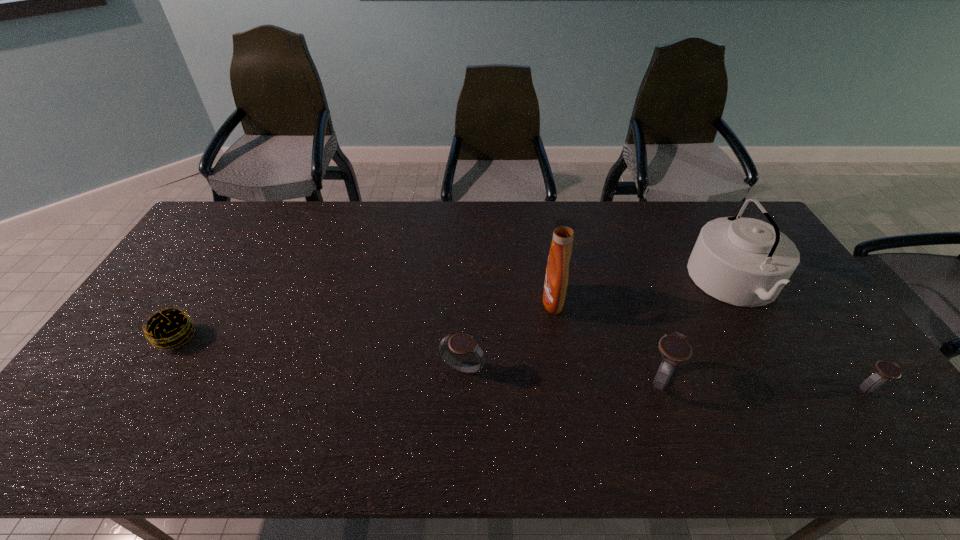
Find the location of a particular element. The height and width of the screenshot is (540, 960). kettle located in the right edge section of the desktop is located at coordinates (746, 262).

Find the location of a particular element. object at the near right corner is located at coordinates (884, 370).

This screenshot has height=540, width=960. In order to click on vacant region at the far edge of the desktop in this screenshot , I will do `click(690, 206)`.

Where is `vacant point at the near edge`? The height and width of the screenshot is (540, 960). vacant point at the near edge is located at coordinates (743, 408).

This screenshot has width=960, height=540. In the image, there is a desktop. In order to click on vacant space at the left edge in this screenshot , I will do `click(192, 307)`.

In the image, there is a desktop. Identify the location of blank space at the right edge. (867, 378).

Find the location of a particular element. The width and height of the screenshot is (960, 540). blank space at the far left corner of the desktop is located at coordinates (243, 209).

What are the coordinates of `free space at the near left corner` in the screenshot? It's located at (111, 394).

Where is `vacant area that lies between the third object from left to right and the second shortest watch`? vacant area that lies between the third object from left to right and the second shortest watch is located at coordinates (508, 335).

At what (x,y) coordinates should I click in order to perform the action: click on vacant space that's between the fourth object from right to left and the fifth shortest object. Please return your answer as a coordinate pair (x, y). This screenshot has height=540, width=960. Looking at the image, I should click on (644, 292).